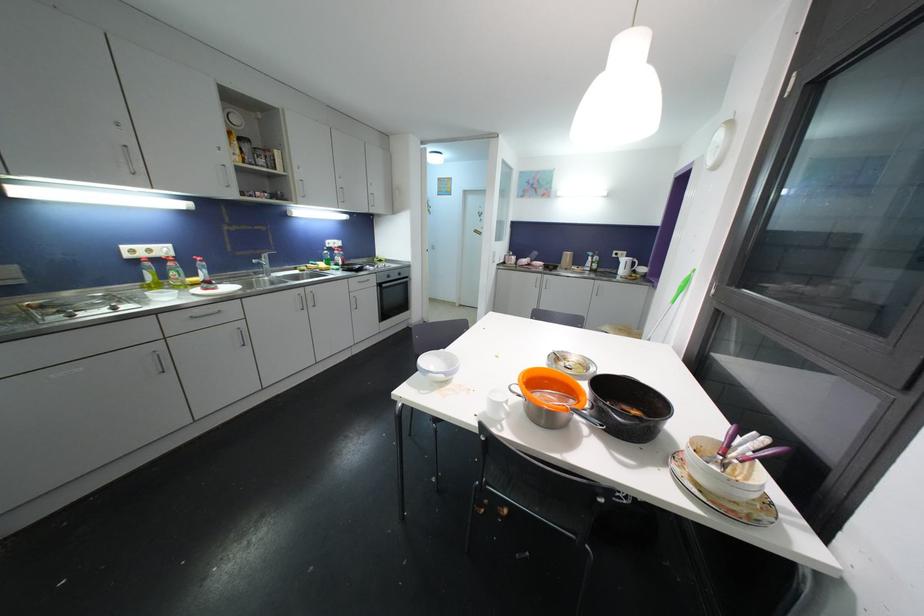
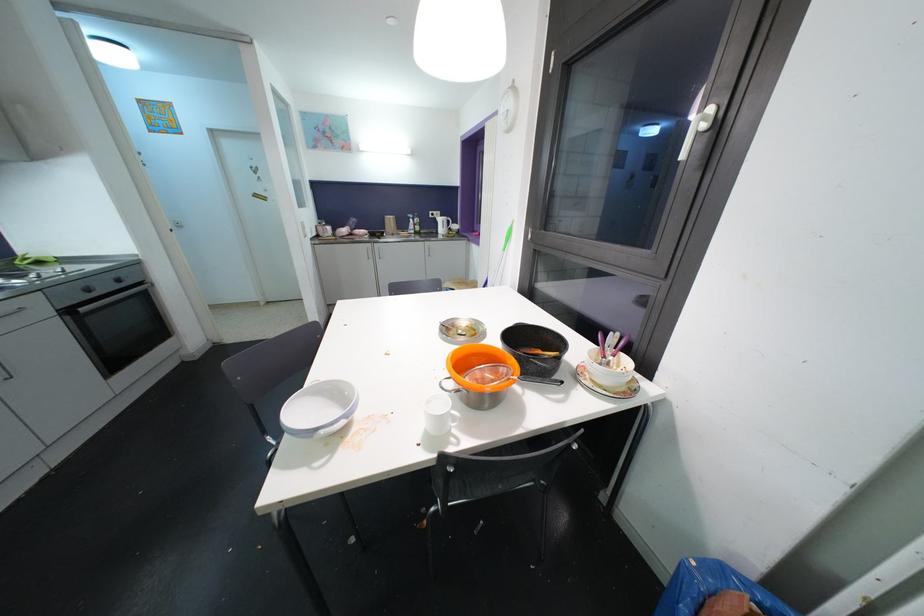
Find the pixel in the second image that matches pixel 390 276 in the first image.

(83, 286)